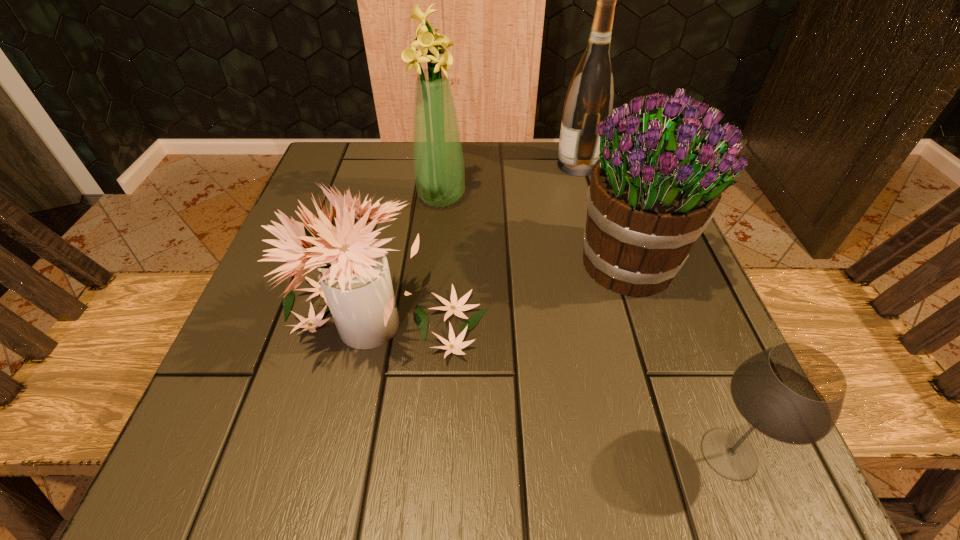
Identify the location of the second farthest object. (438, 162).

Identify the location of the tallest bouquet. The width and height of the screenshot is (960, 540). (438, 162).

Identify the location of the farthest object. This screenshot has width=960, height=540. (589, 100).

Where is `the third shortest object`? The width and height of the screenshot is (960, 540). the third shortest object is located at coordinates (653, 191).

Identify the location of the rightmost bouquet. (653, 191).

At what (x,y) coordinates should I click in order to perform the action: click on the shortest bouquet. Please return your answer as a coordinate pair (x, y). Image resolution: width=960 pixels, height=540 pixels. Looking at the image, I should click on (356, 285).

This screenshot has width=960, height=540. Identify the location of the shortest object. (793, 393).

This screenshot has height=540, width=960. I want to click on wineglass, so click(x=793, y=393).

The width and height of the screenshot is (960, 540). What are the coordinates of `vacant space located on the front-facing side of the tallest bouquet` in the screenshot? It's located at (575, 197).

Locate an element on the screen. The height and width of the screenshot is (540, 960). free spot located 0.360m on the label of the wine bottle is located at coordinates (399, 165).